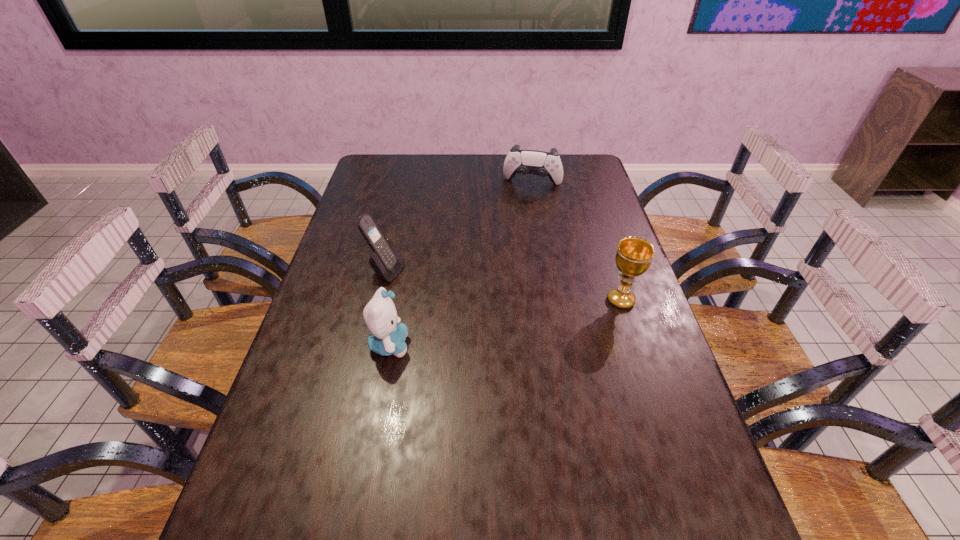
Where is `the nearest object`? This screenshot has height=540, width=960. the nearest object is located at coordinates (388, 335).

Locate an element on the screen. The width and height of the screenshot is (960, 540). the second nearest object is located at coordinates (634, 255).

The image size is (960, 540). Identify the location of the rightmost object. (634, 255).

Locate an element on the screen. This screenshot has width=960, height=540. the farthest object is located at coordinates [523, 162].

Identify the location of control. (523, 162).

At what (x,y) coordinates should I click in order to perform the action: click on cellular telephone. Please return your answer as a coordinate pair (x, y). Looking at the image, I should click on (386, 261).

Find the location of a particular element. The image size is (960, 540). vacant point located on the face of the kitten is located at coordinates (515, 345).

The height and width of the screenshot is (540, 960). Find the location of `free space located 0.150m on the front of the chalice`. free space located 0.150m on the front of the chalice is located at coordinates (640, 359).

Where is `free region located 0.150m on the front-facing side of the farthest object`? The image size is (960, 540). free region located 0.150m on the front-facing side of the farthest object is located at coordinates (523, 215).

Where is `vacant area located 0.360m on the front-facing side of the farthest object`? vacant area located 0.360m on the front-facing side of the farthest object is located at coordinates (515, 255).